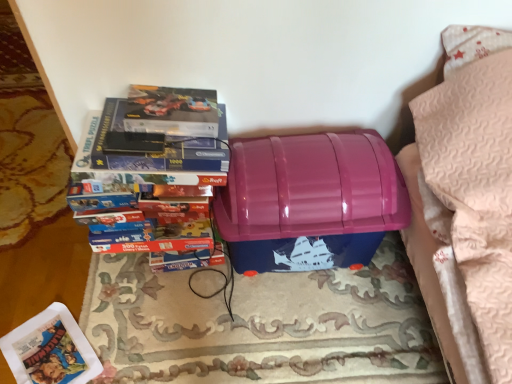
Question: In terms of height, does glossy plastic storage box at center look taller or shorter compared to rug/carpet at center?

Choices:
 (A) short
 (B) tall

Answer: (B)

Question: From a real-world perspective, relative to rug/carpet at center, is glossy plastic storage box at center vertically above or below?

Choices:
 (A) below
 (B) above

Answer: (B)

Question: Estimate the real-world distances between objects in this image. Which object is farther from the blue cardboard puzzle at left?

Choices:
 (A) rug/carpet at center
 (B) matte plastic paperback book at lower left
 (C) glossy plastic storage box at center

Answer: (B)

Question: Which object is the closest to the rug/carpet at center?

Choices:
 (A) matte plastic paperback book at lower left
 (B) blue cardboard puzzle at left
 (C) glossy plastic storage box at center

Answer: (C)